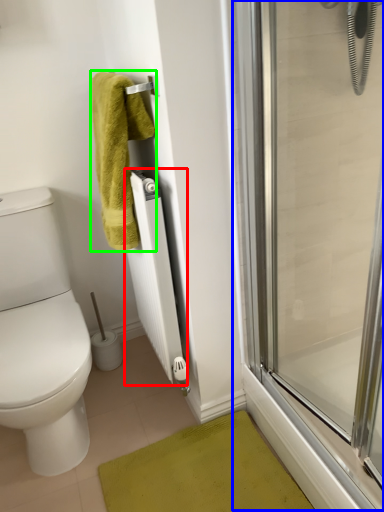
Question: Which object is positioned farthest from radiator (highlighted by a red box)? Select from screen door (highlighted by a blue box) and towel (highlighted by a green box).

Choices:
 (A) screen door
 (B) towel

Answer: (A)